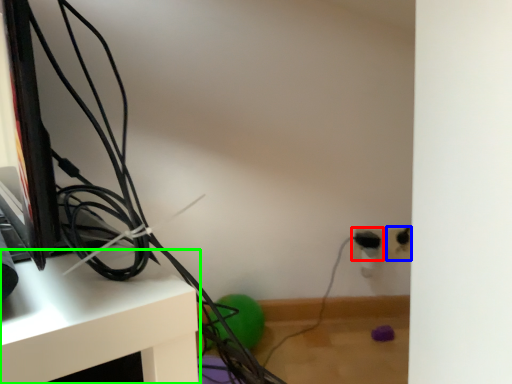
Question: Estimate the real-world distances between objects in this image. Which object is farther from electric outlet (highlighted by a red box), electric outlet (highlighted by a blue box) or furniture (highlighted by a green box)?

Choices:
 (A) electric outlet
 (B) furniture

Answer: (B)